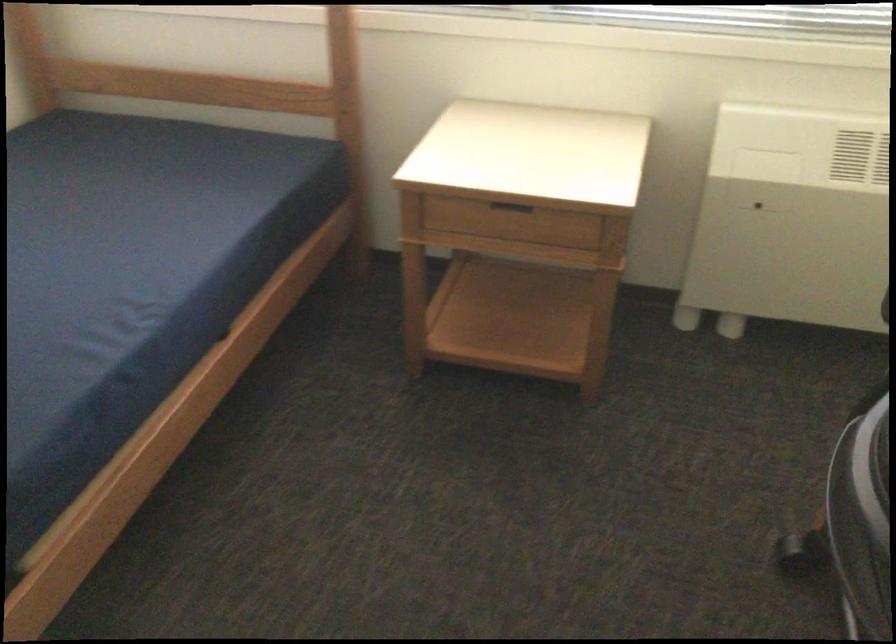
The image size is (896, 644). Find the location of `dark drawer handle`. dark drawer handle is located at coordinates (510, 210).